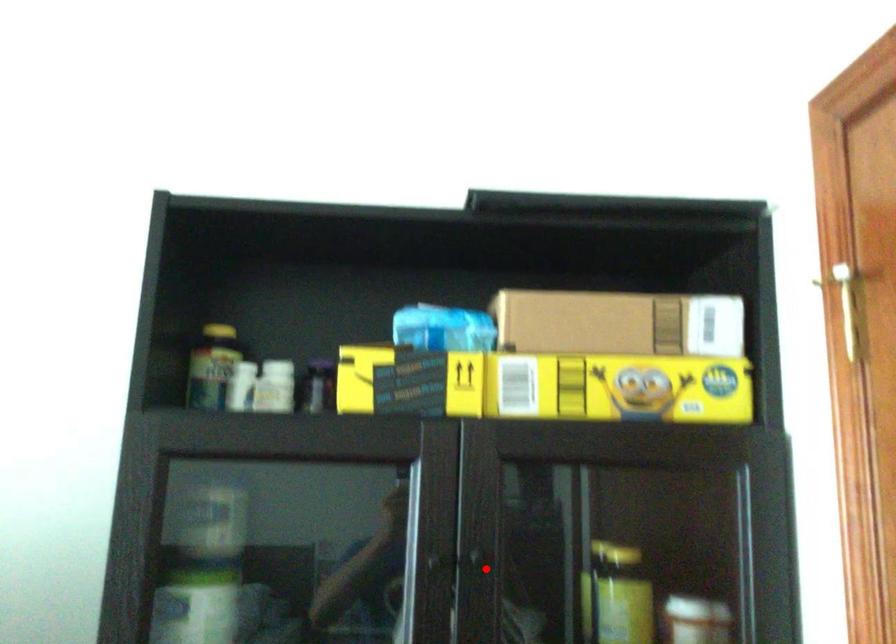
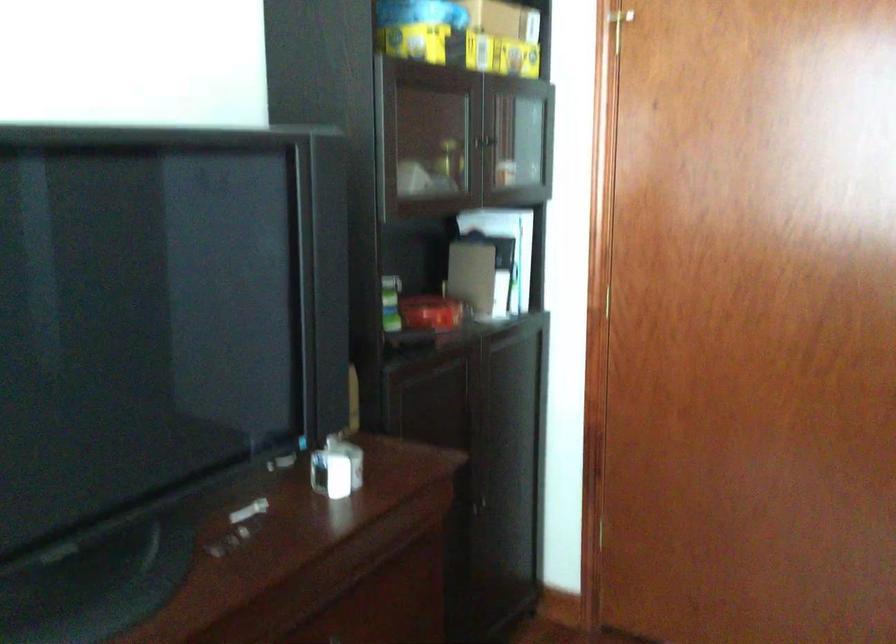
In the second image, find the point that corresponds to the highlighted location in the first image.

(492, 140)